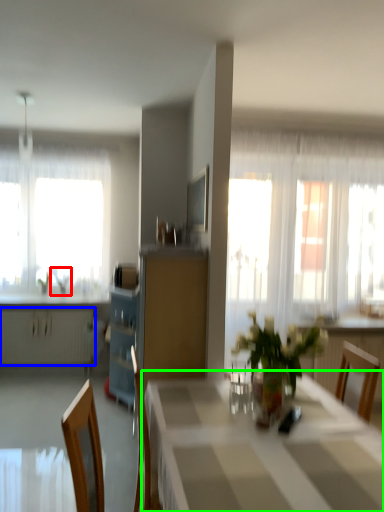
Question: Estimate the real-world distances between objects in this image. Which object is farther from plant (highlighted by a red box), radiator (highlighted by a blue box) or table (highlighted by a green box)?

Choices:
 (A) radiator
 (B) table

Answer: (B)